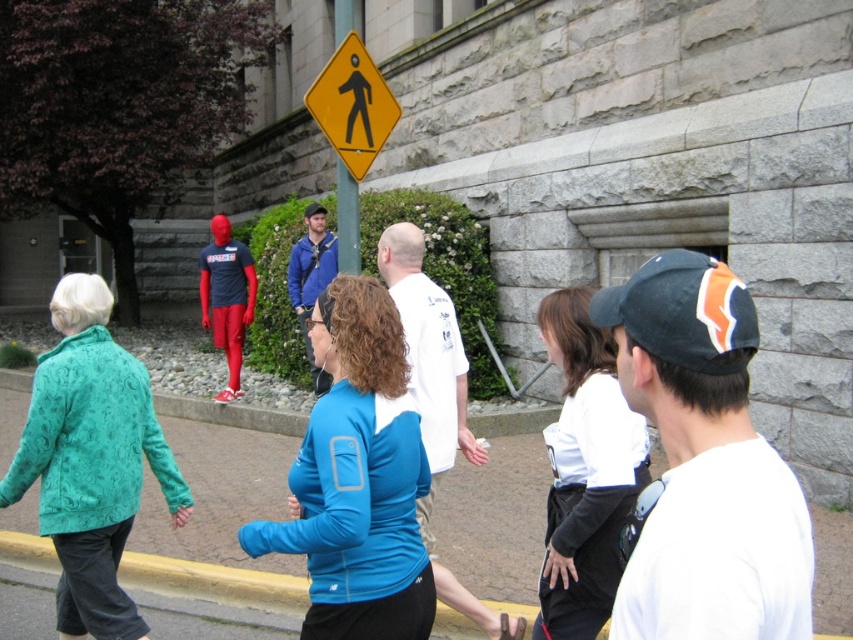
Question: Which of these objects is positioned closest to the yellow plastic pedestrian sign at upper center?

Choices:
 (A) blue fabric at center
 (B) blue fabric shirt at center
 (C) white cotton shirt at center
 (D) teal textured jacket at lower left

Answer: (A)

Question: Is white cotton shirt at center bigger than yellow plastic pedestrian sign at upper center?

Choices:
 (A) no
 (B) yes

Answer: (A)

Question: Which of the following is the closest to the observer?

Choices:
 (A) blue fabric shirt at center
 (B) white cotton shirt at center
 (C) teal textured jacket at lower left
 (D) yellow plastic pedestrian sign at upper center

Answer: (A)

Question: Is blue fabric at center to the left of teal textured jacket at lower left from the viewer's perspective?

Choices:
 (A) no
 (B) yes

Answer: (A)

Question: Estimate the real-world distances between objects in this image. Which object is closer to the blue fabric shirt at center?

Choices:
 (A) white cotton shirt at center
 (B) yellow plastic pedestrian sign at upper center
 (C) teal textured jacket at lower left

Answer: (A)

Question: Is blue fabric shirt at center behind yellow plastic pedestrian sign at upper center?

Choices:
 (A) no
 (B) yes

Answer: (A)